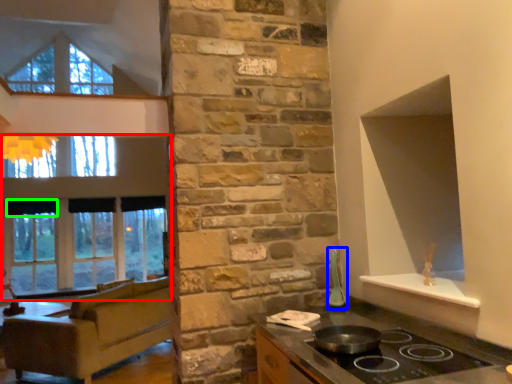
Question: Which is farther away from window (highlighted by a red box)? appliance (highlighted by a blue box) or curtain (highlighted by a green box)?

Choices:
 (A) appliance
 (B) curtain

Answer: (A)